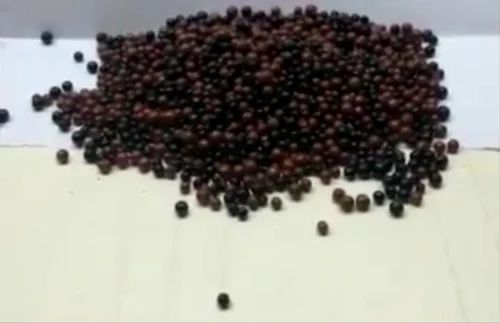
Where is `front cream area of table`? front cream area of table is located at coordinates (100, 275), (434, 282).